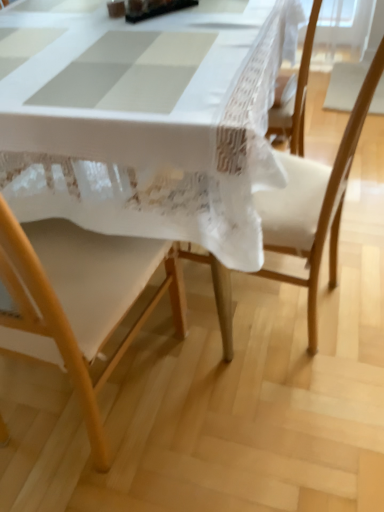
Question: Would you say wooden chair at center, arranged as the first chair when viewed from the right, is outside white lace tablecloth at center?

Choices:
 (A) no
 (B) yes

Answer: (A)

Question: Can you confirm if wooden chair at center, arranged as the 2th chair when viewed from the left, is wider than white lace tablecloth at center?

Choices:
 (A) no
 (B) yes

Answer: (A)

Question: From a real-world perspective, is wooden chair at center, arranged as the 2th chair when viewed from the left, over white lace tablecloth at center?

Choices:
 (A) no
 (B) yes

Answer: (B)

Question: Can you confirm if wooden chair at center, arranged as the first chair when viewed from the right, is bigger than white lace tablecloth at center?

Choices:
 (A) yes
 (B) no

Answer: (B)

Question: Considering the relative positions of wooden chair at center, arranged as the first chair when viewed from the right, and white lace tablecloth at center in the image provided, is wooden chair at center, arranged as the first chair when viewed from the right, to the left of white lace tablecloth at center from the viewer's perspective?

Choices:
 (A) no
 (B) yes

Answer: (A)

Question: Is white lace tablecloth at center at the back of wooden chair at center, arranged as the 2th chair when viewed from the left?

Choices:
 (A) yes
 (B) no

Answer: (A)

Question: Would you say wooden chair at lower left, the 1th chair in the left-to-right sequence, is part of wooden chair at center, arranged as the first chair when viewed from the right,'s contents?

Choices:
 (A) no
 (B) yes

Answer: (A)

Question: Does wooden chair at center, arranged as the first chair when viewed from the right, come in front of wooden chair at lower left, acting as the 2th chair starting from the right?

Choices:
 (A) no
 (B) yes

Answer: (A)

Question: Does wooden chair at center, arranged as the first chair when viewed from the right, appear on the left side of wooden chair at lower left, the 1th chair in the left-to-right sequence?

Choices:
 (A) yes
 (B) no

Answer: (B)

Question: Considering the relative sizes of wooden chair at center, arranged as the first chair when viewed from the right, and wooden chair at lower left, acting as the 2th chair starting from the right, in the image provided, is wooden chair at center, arranged as the first chair when viewed from the right, wider than wooden chair at lower left, acting as the 2th chair starting from the right,?

Choices:
 (A) yes
 (B) no

Answer: (A)

Question: Considering the relative sizes of wooden chair at center, arranged as the first chair when viewed from the right, and wooden chair at lower left, acting as the 2th chair starting from the right, in the image provided, is wooden chair at center, arranged as the first chair when viewed from the right, smaller than wooden chair at lower left, acting as the 2th chair starting from the right,?

Choices:
 (A) yes
 (B) no

Answer: (B)

Question: Is wooden chair at center, arranged as the first chair when viewed from the right, oriented towards wooden chair at lower left, acting as the 2th chair starting from the right?

Choices:
 (A) no
 (B) yes

Answer: (A)

Question: From the image's perspective, would you say white lace tablecloth at center is shown under wooden chair at center, arranged as the first chair when viewed from the right?

Choices:
 (A) no
 (B) yes

Answer: (A)